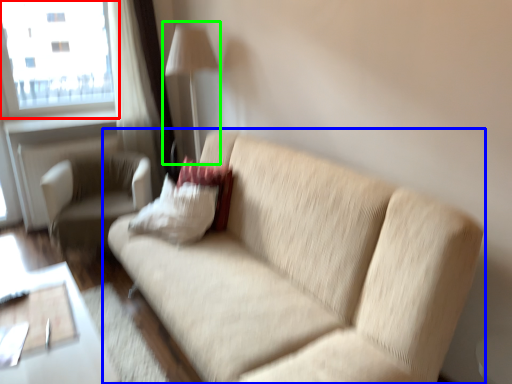
Question: Which object is the farthest from window (highlighted by a red box)? Choose among these: studio couch (highlighted by a blue box) or table lamp (highlighted by a green box).

Choices:
 (A) studio couch
 (B) table lamp

Answer: (A)